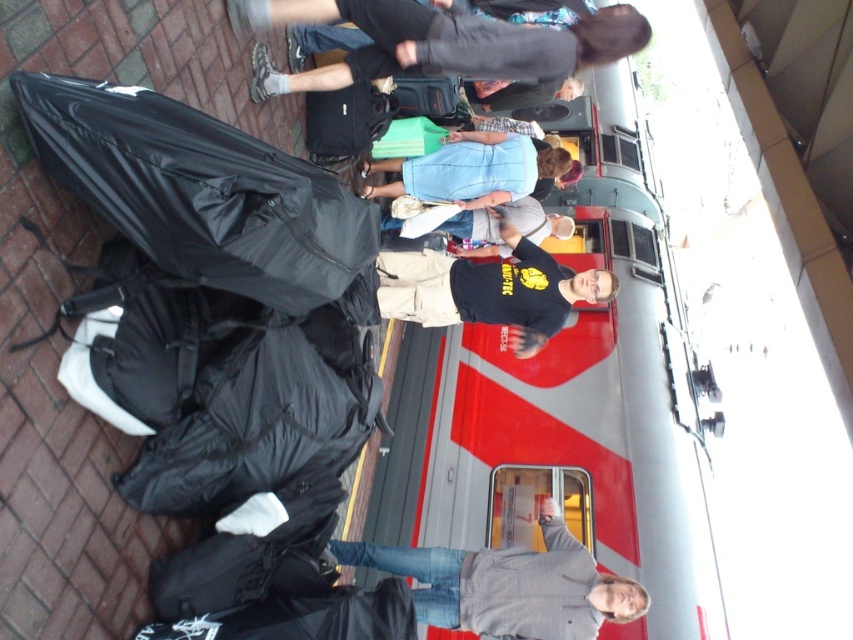
Between dark gray pants at center and gray cotton hoodie at center, which one appears on the left side from the viewer's perspective?

From the viewer's perspective, dark gray pants at center appears more on the left side.

Measure the distance from dark gray pants at center to gray cotton hoodie at center.

They are 7.14 feet apart.

Looking at this image, measure the distance between point (252, 88) and camera.

Point (252, 88) is 10.94 feet from camera.

Image resolution: width=853 pixels, height=640 pixels. Find the location of `dark gray pants at center`. dark gray pants at center is located at coordinates (437, 42).

Can you confirm if matte black jacket at center is positioned to the right of green fabric bag at center?

Correct, you'll find matte black jacket at center to the right of green fabric bag at center.

Does matte black jacket at center appear on the left side of green fabric bag at center?

In fact, matte black jacket at center is to the right of green fabric bag at center.

Image resolution: width=853 pixels, height=640 pixels. Identify the location of matte black jacket at center. (521, 93).

Locate an element on the screen. matte black jacket at center is located at coordinates (521, 93).

Which is more to the right, black t-shirt at center or matte black backpack at center?

Positioned to the right is black t-shirt at center.

Consider the image. Can you confirm if black t-shirt at center is thinner than matte black backpack at center?

No.

Is point (518, 205) behind point (437, 99)?

Yes, it is behind point (437, 99).

You are a GUI agent. You are given a task and a screenshot of the screen. Output one action in this format:
    pyautogui.click(x=<x>, y=<y>)
    Task: Click on the black t-shirt at center
    This screenshot has height=640, width=853.
    Given the screenshot: What is the action you would take?
    pyautogui.click(x=459, y=228)